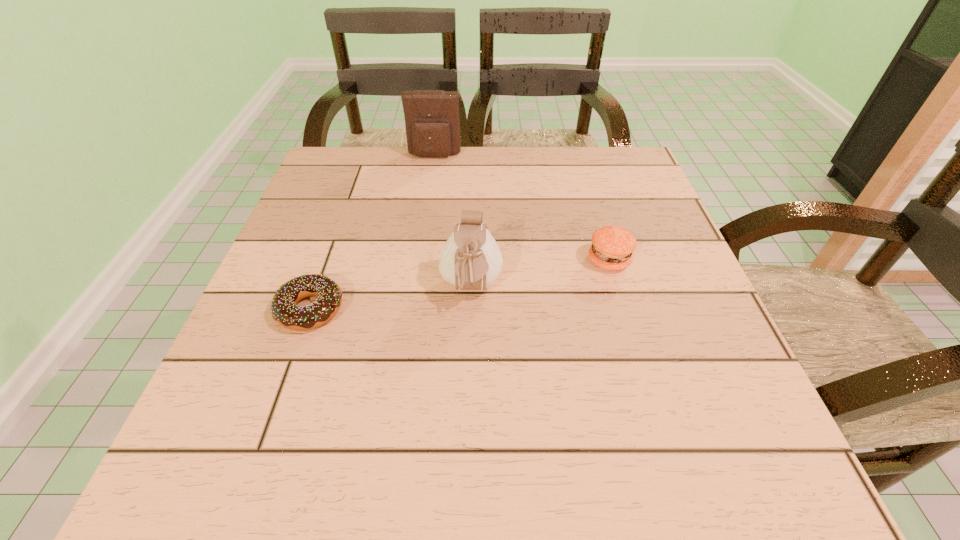
What are the coordinates of `vacant space that satisfies the following two spatial constraints: 1. with an open flap on the rightmost object; 2. on the left side of the farther pouch` in the screenshot? It's located at (420, 260).